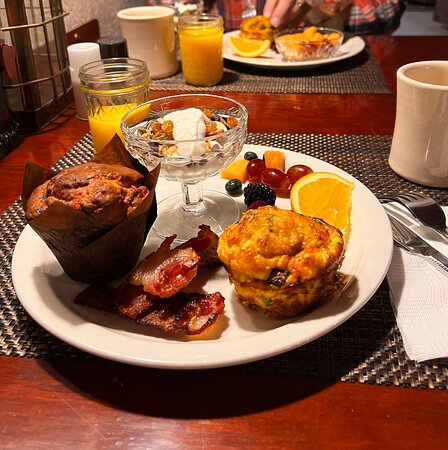
Locate an element on the screen. This screenshot has height=450, width=448. cutlery is located at coordinates (439, 207), (397, 233).